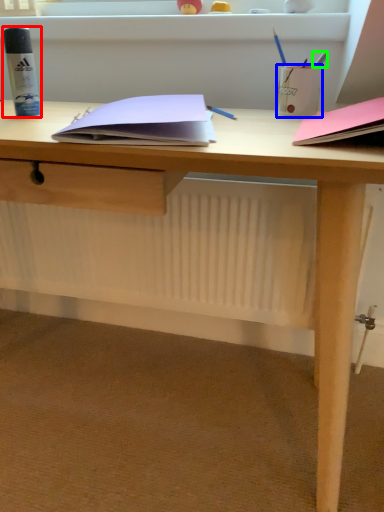
Question: Based on their relative distances, which object is nearer to stationery (highlighted by a red box)? Choose from stationery (highlighted by a blue box) and stationery (highlighted by a green box).

Choices:
 (A) stationery
 (B) stationery

Answer: (A)